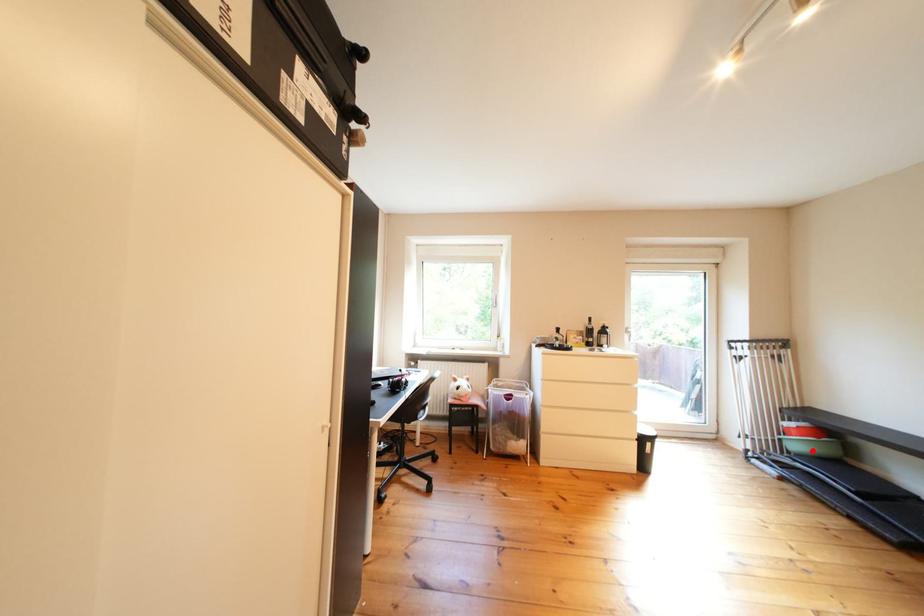
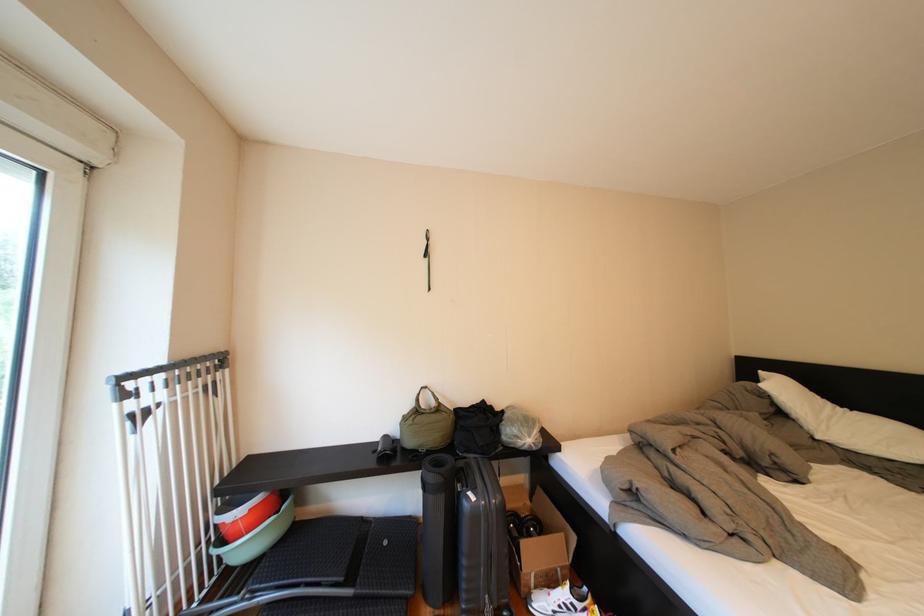
Locate, in the second image, the point that corresponds to the highlighted location in the first image.

(261, 551)